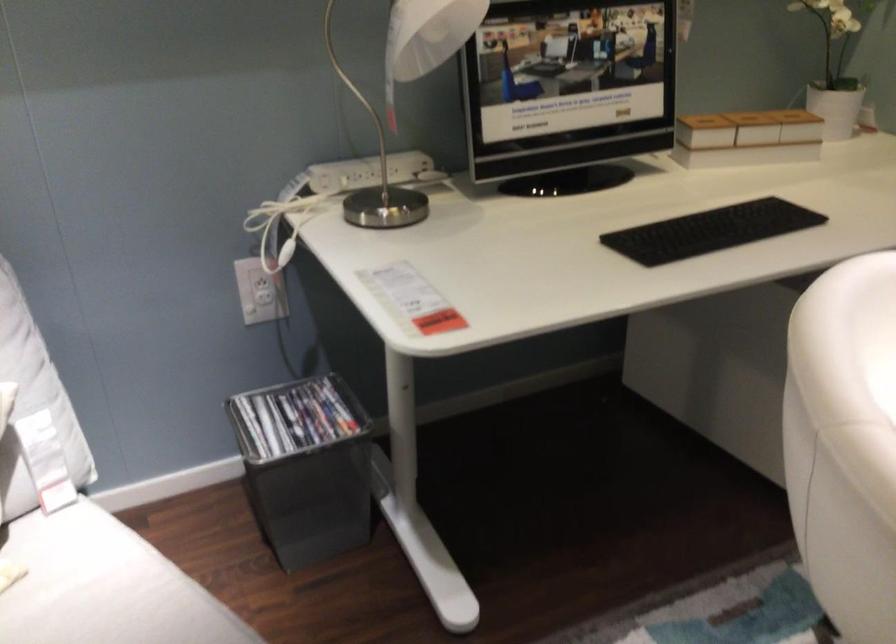
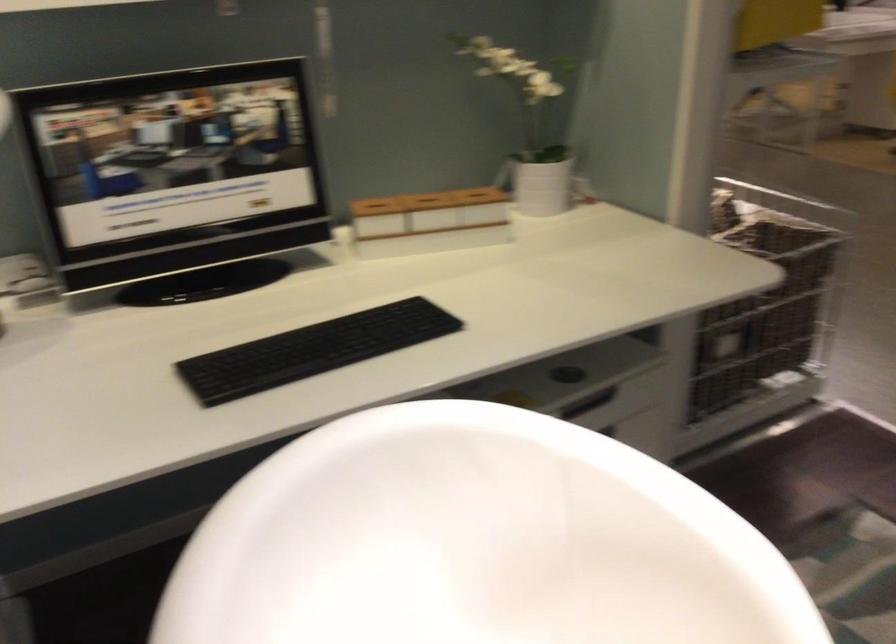
In the second image, find the point that corresponds to the point at 757,114 in the first image.

(426, 198)